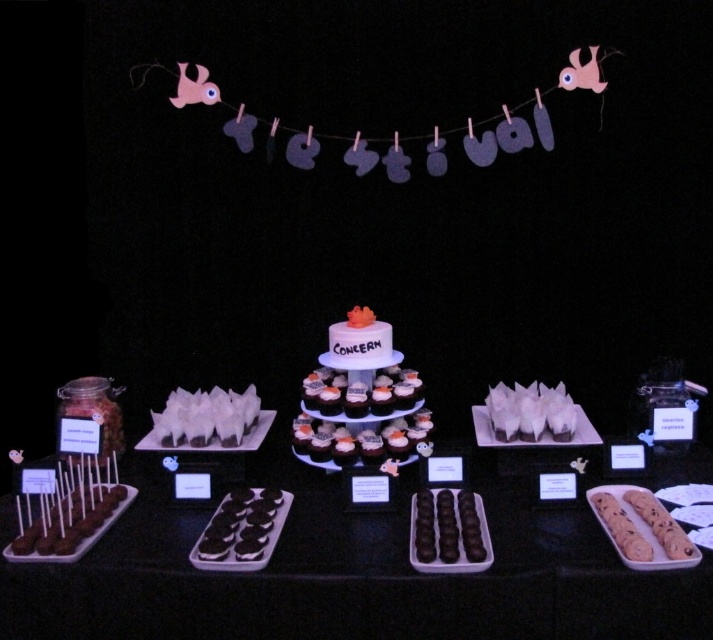
You are a customer at a dessert buffet and want to locate the chocolate matte cake at center. Based on the coordinates provided, where should you look on the dessert table?

The chocolate matte cake at center is located at coordinates point (356, 577) on the dessert table.

You are a customer at a dessert shop and see the smooth chocolate truffles at center and the white paper bag at center on the table. Which item is shorter?

The smooth chocolate truffles at center are shorter than the white paper bag at center.

You are a dessert vendor who needs to pack the smooth chocolate truffles at center and the white paper bag at center into a box. Based on their sizes, which item will require a larger box?

The white paper bag at center requires a larger box because it has a greater width than the smooth chocolate truffles at center.